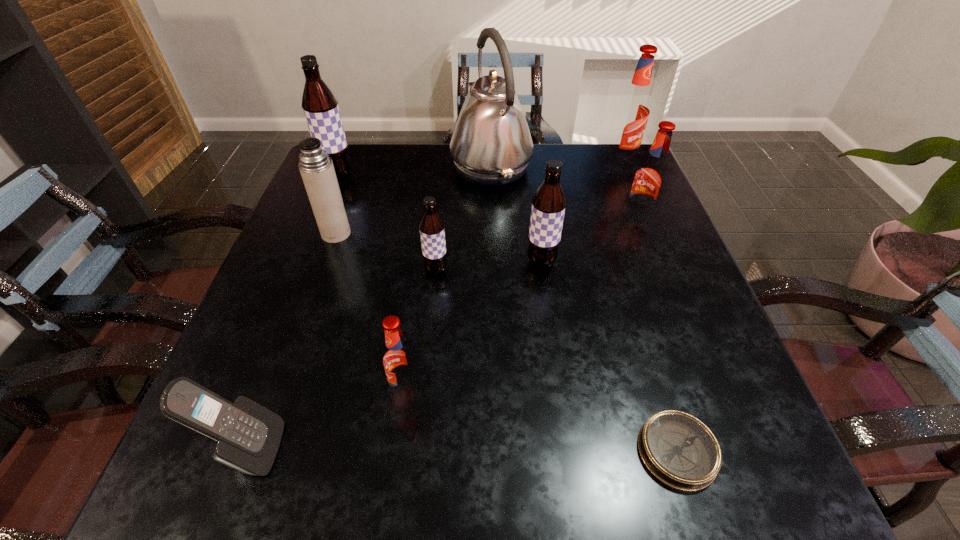
Where is `blank space located on the back of the third nearest object`? This screenshot has height=540, width=960. blank space located on the back of the third nearest object is located at coordinates (425, 243).

At what (x,y) coordinates should I click in order to perform the action: click on vacant space located 0.320m on the right of the second brown root beer from right to left. Please return your answer as a coordinate pair (x, y). The width and height of the screenshot is (960, 540). Looking at the image, I should click on (600, 269).

Locate an element on the screen. Image resolution: width=960 pixels, height=540 pixels. blank space located 0.090m on the front-facing side of the cellular telephone is located at coordinates (339, 449).

Where is `vacant space located on the left of the compass`? vacant space located on the left of the compass is located at coordinates (598, 451).

Locate an element on the screen. The height and width of the screenshot is (540, 960). kettle that is at the far edge is located at coordinates (491, 145).

Where is `cellular telephone present at the near edge`? cellular telephone present at the near edge is located at coordinates (248, 435).

Locate an element on the screen. The width and height of the screenshot is (960, 540). compass that is at the near edge is located at coordinates (678, 449).

I want to click on root beer at the left edge, so click(x=320, y=105).

You are a GUI agent. You are given a task and a screenshot of the screen. Output one action in this format:
    pyautogui.click(x=<x>, y=<y>)
    Task: Click on the thermos bottle that is at the left edge
    
    Given the screenshot: What is the action you would take?
    pyautogui.click(x=316, y=168)

Locate an element on the screen. The height and width of the screenshot is (540, 960). cellular telephone located in the left edge section of the desktop is located at coordinates point(248,435).